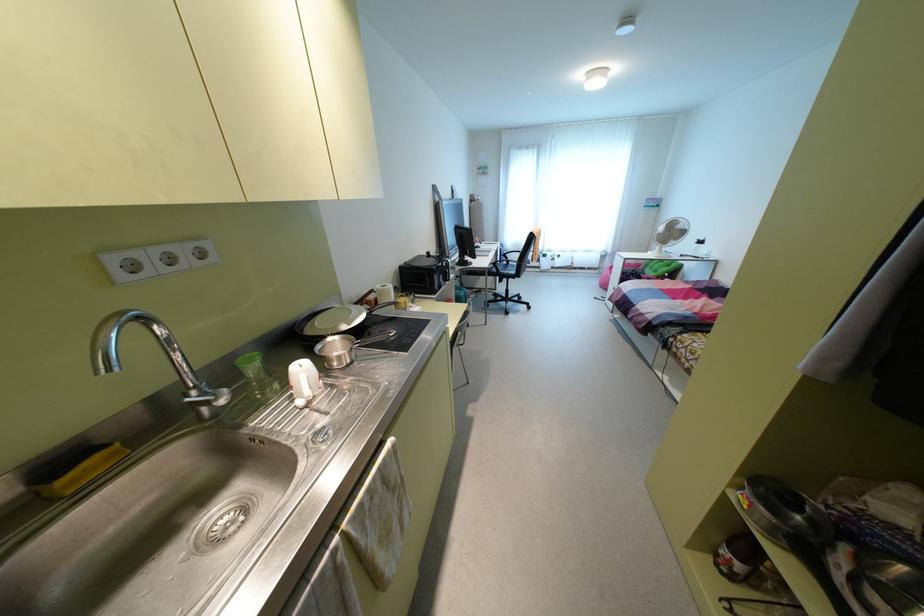
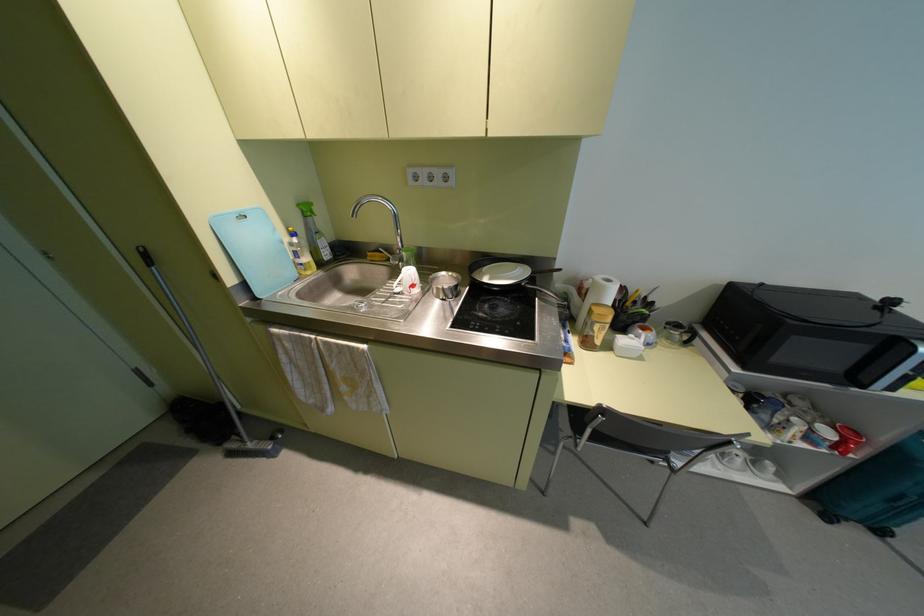
Where in the second image is the point corresponding to pixel 378 286 from the first image?

(599, 277)